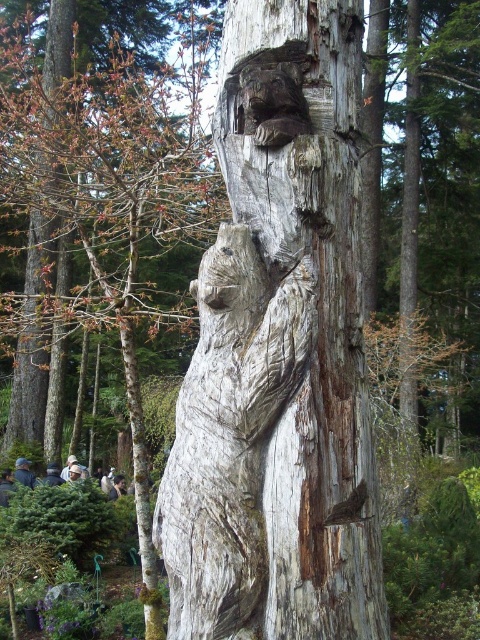
Question: Is weathered wood carving at center smaller than gray wood bear at center?

Choices:
 (A) no
 (B) yes

Answer: (A)

Question: Is weathered wood carving at center positioned in front of gray wood bear at center?

Choices:
 (A) no
 (B) yes

Answer: (B)

Question: Is weathered wood carving at center below gray wood bear at center?

Choices:
 (A) yes
 (B) no

Answer: (B)